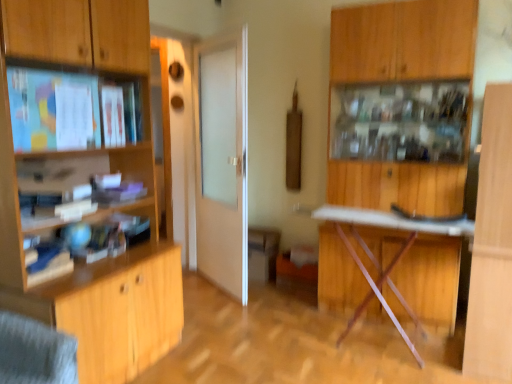
This screenshot has width=512, height=384. What do you see at coordinates (222, 161) in the screenshot?
I see `white frosted glass door at center` at bounding box center [222, 161].

The image size is (512, 384). Find the location of `wooden cabinet at left, which is the first cabinetry from left to right`. wooden cabinet at left, which is the first cabinetry from left to right is located at coordinates (84, 183).

Where is `wooden cabinet at center, placed as the first cabinetry when sorted from back to front`? wooden cabinet at center, placed as the first cabinetry when sorted from back to front is located at coordinates (262, 254).

The width and height of the screenshot is (512, 384). Identify the location of metallic silver table at center. coord(395,254).

You are a GUI agent. You are given a task and a screenshot of the screen. Output one action in this format:
    pyautogui.click(x=<x>, y=<y>)
    Task: Click on the white frosted glass door at center
    This screenshot has height=384, width=512.
    Given the screenshot: What is the action you would take?
    pyautogui.click(x=222, y=161)

Can you confirm if wooden cabinet at center, acting as the second cabinetry starting from the left, is bigger than metallic silver table at center?

No.

Is wooden cabinet at center, the first cabinetry when ordered from right to left, positioned behind metallic silver table at center?

Yes, it is behind metallic silver table at center.

Could metallic silver table at center be considered to be inside wooden cabinet at center, placed as the first cabinetry when sorted from back to front?

That's incorrect, metallic silver table at center is not inside wooden cabinet at center, placed as the first cabinetry when sorted from back to front.

From the picture: From their relative heights in the image, would you say wooden cabinet at center, placed as the first cabinetry when sorted from back to front, is taller or shorter than metallic silver table at center?

Considering their sizes, wooden cabinet at center, placed as the first cabinetry when sorted from back to front, has less height than metallic silver table at center.

Is metallic silver table at center oriented away from wooden cabinet at center, acting as the second cabinetry starting from the left?

No, wooden cabinet at center, acting as the second cabinetry starting from the left, is not at the back of metallic silver table at center.

Would you say wooden cabinet at center, the first cabinetry when ordered from right to left, is part of metallic silver table at center's contents?

Actually, wooden cabinet at center, the first cabinetry when ordered from right to left, is outside metallic silver table at center.

Is metallic silver table at center taller or shorter than wooden cabinet at center, the first cabinetry when ordered from right to left?

metallic silver table at center is taller than wooden cabinet at center, the first cabinetry when ordered from right to left.

Measure the distance between metallic silver table at center and wooden cabinet at center, acting as the second cabinetry starting from the left.

metallic silver table at center and wooden cabinet at center, acting as the second cabinetry starting from the left, are 97.97 centimeters apart from each other.

Is point (393, 291) farther from viewer compared to point (23, 306)?

Yes.

Does metallic silver table at center have a larger size compared to wooden cabinet at left, which ranks as the 1th cabinetry in front-to-back order?

Incorrect, metallic silver table at center is not larger than wooden cabinet at left, which ranks as the 1th cabinetry in front-to-back order.

Is metallic silver table at center next to wooden cabinet at left, which appears as the 2th cabinetry when viewed from the back?

No, metallic silver table at center is not next to wooden cabinet at left, which appears as the 2th cabinetry when viewed from the back.

Based on the photo, in terms of height, does metallic silver table at center look taller or shorter compared to wooden cabinet at left, which ranks as the 1th cabinetry in front-to-back order?

In the image, metallic silver table at center appears to be shorter than wooden cabinet at left, which ranks as the 1th cabinetry in front-to-back order.

Is metallic silver table at center inside the boundaries of matte wooden shelf at upper left, or outside?

The correct answer is: outside.

Does point (407, 311) come closer to viewer compared to point (92, 120)?

No, (407, 311) is further to viewer.

How many degrees apart are the facing directions of metallic silver table at center and matte wooden shelf at upper left?

There is a 88.5-degree angle between the facing directions of metallic silver table at center and matte wooden shelf at upper left.

Considering the relative sizes of metallic silver table at center and matte wooden shelf at upper left in the image provided, is metallic silver table at center thinner than matte wooden shelf at upper left?

Yes.

Which is closer to the camera, (x=62, y=114) or (x=57, y=172)?

The point (x=62, y=114) is more forward.

In the scene shown: Considering the sizes of objects matte wooden shelf at upper left and wooden cabinet at left, which is the first cabinetry from left to right, in the image provided, who is wider, matte wooden shelf at upper left or wooden cabinet at left, which is the first cabinetry from left to right,?

wooden cabinet at left, which is the first cabinetry from left to right.

Is matte wooden shelf at upper left in front of or behind wooden cabinet at left, which appears as the 2th cabinetry when viewed from the back, in the image?

Visually, matte wooden shelf at upper left is located behind wooden cabinet at left, which appears as the 2th cabinetry when viewed from the back.

Which object is positioned more to the right, matte wooden shelf at upper left or wooden cabinet at left, which appears as the 2th cabinetry when viewed from the back?

wooden cabinet at left, which appears as the 2th cabinetry when viewed from the back, is more to the right.

How far apart are metallic silver table at center and white frosted glass door at center?

metallic silver table at center and white frosted glass door at center are 1.03 meters apart from each other.

Does metallic silver table at center have a smaller size compared to white frosted glass door at center?

No.

From the image's perspective, is metallic silver table at center above white frosted glass door at center?

Incorrect, from the image's perspective, metallic silver table at center is lower than white frosted glass door at center.

Is metallic silver table at center at the right side of white frosted glass door at center?

Yes.

In the scene shown: Considering the sizes of objects white frosted glass door at center and wooden cabinet at center, which appears as the second cabinetry when viewed from the front, in the image provided, who is thinner, white frosted glass door at center or wooden cabinet at center, which appears as the second cabinetry when viewed from the front,?

With smaller width is white frosted glass door at center.

Which object is positioned more to the right, white frosted glass door at center or wooden cabinet at center, acting as the second cabinetry starting from the left?

From the viewer's perspective, wooden cabinet at center, acting as the second cabinetry starting from the left, appears more on the right side.

Based on the photo, can you confirm if white frosted glass door at center is shorter than wooden cabinet at center, which appears as the second cabinetry when viewed from the front?

In fact, white frosted glass door at center may be taller than wooden cabinet at center, which appears as the second cabinetry when viewed from the front.

From the metallic silver table at center, count the 1st cabinetry to the left and point to it. Please provide its 2D coordinates.

[(262, 254)]

You are a GUI agent. You are given a task and a screenshot of the screen. Output one action in this format:
    pyautogui.click(x=<x>, y=<y>)
    Task: Click on the cabinetry behind the metallic silver table at center
    Image resolution: width=512 pixels, height=384 pixels.
    Given the screenshot: What is the action you would take?
    pyautogui.click(x=262, y=254)

Looking at the image, which one is located further to metallic silver table at center, wooden cabinet at left, which appears as the 2th cabinetry when viewed from the back, or wooden cabinet at upper right?

wooden cabinet at left, which appears as the 2th cabinetry when viewed from the back, is further to metallic silver table at center.

Consider the image. From the image, which object appears to be nearer to metallic silver table at center, white frosted glass door at center or wooden cabinet at center, the first cabinetry when ordered from right to left?

wooden cabinet at center, the first cabinetry when ordered from right to left, is closer to metallic silver table at center.

When comparing their distances from wooden cabinet at center, acting as the second cabinetry starting from the left, does metallic silver table at center or wooden cabinet at left, which is the first cabinetry from left to right, seem further?

wooden cabinet at left, which is the first cabinetry from left to right, is further to wooden cabinet at center, acting as the second cabinetry starting from the left.

When comparing their distances from wooden cabinet at upper right, does wooden cabinet at left, which appears as the 2th cabinetry when viewed from the back, or matte wooden shelf at upper left seem closer?

Based on the image, wooden cabinet at left, which appears as the 2th cabinetry when viewed from the back, appears to be nearer to wooden cabinet at upper right.

Considering their positions, is wooden cabinet at center, the first cabinetry when ordered from right to left, positioned further to matte wooden shelf at upper left than wooden cabinet at upper right?

wooden cabinet at center, the first cabinetry when ordered from right to left.

Looking at the image, which one is located further to wooden cabinet at upper right, metallic silver table at center or wooden cabinet at center, placed as the first cabinetry when sorted from back to front?

wooden cabinet at center, placed as the first cabinetry when sorted from back to front.

Based on their spatial positions, is matte wooden shelf at upper left or metallic silver table at center further from wooden cabinet at center, which appears as the second cabinetry when viewed from the front?

matte wooden shelf at upper left is further to wooden cabinet at center, which appears as the second cabinetry when viewed from the front.

Based on their spatial positions, is wooden cabinet at left, which is counted as the 2th cabinetry, starting from the right, or matte wooden shelf at upper left further from wooden cabinet at center, acting as the second cabinetry starting from the left?

Based on the image, matte wooden shelf at upper left appears to be further to wooden cabinet at center, acting as the second cabinetry starting from the left.

I want to click on door located between metallic silver table at center and wooden cabinet at center, placed as the first cabinetry when sorted from back to front, in the depth direction, so click(x=222, y=161).

The width and height of the screenshot is (512, 384). In order to click on shelf between wooden cabinet at left, which is the first cabinetry from left to right, and wooden cabinet at center, acting as the second cabinetry starting from the left, in the front-back direction in this screenshot , I will do `click(71, 110)`.

Identify the location of dresser positioned between wooden cabinet at left, which ranks as the 1th cabinetry in front-to-back order, and wooden cabinet at center, acting as the second cabinetry starting from the left, from near to far. This screenshot has width=512, height=384. (397, 158).

The width and height of the screenshot is (512, 384). Find the location of `door between matte wooden shelf at upper left and wooden cabinet at upper right in the horizontal direction`. door between matte wooden shelf at upper left and wooden cabinet at upper right in the horizontal direction is located at coordinates (222, 161).